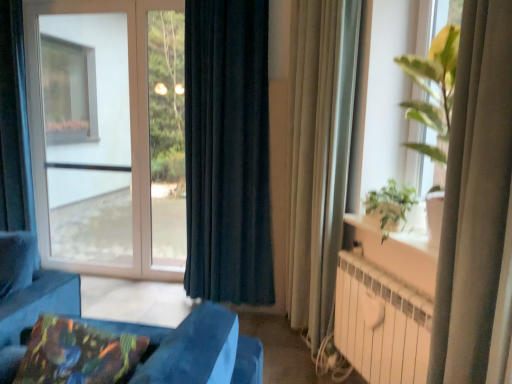
Question: Relative to green leafy plant at upper right, marked as the first window in a right-to-left arrangement, is white metallic radiator at lower right in front or behind?

Choices:
 (A) behind
 (B) front

Answer: (A)

Question: Would you say white metallic radiator at lower right is inside or outside green leafy plant at upper right, marked as the first window in a right-to-left arrangement?

Choices:
 (A) inside
 (B) outside

Answer: (B)

Question: Estimate the real-world distances between objects in this image. Which object is farther from the transparent glass window at left, the second window when ordered from front to back?

Choices:
 (A) green leafy plant at right
 (B) beige fabric curtain at right, the second curtain when ordered from left to right
 (C) green leafy plant at upper right, marked as the first window in a right-to-left arrangement
 (D) beige sheer curtain at right, arranged as the first curtain when viewed from the right
 (E) dark blue fabric curtain at center, the 1th curtain from the left

Answer: (D)

Question: Estimate the real-world distances between objects in this image. Which object is farther from the beige fabric curtain at right, which appears as the 2th curtain when viewed from the front?

Choices:
 (A) transparent glass window at left, the first window in the left-to-right sequence
 (B) multicolored fabric pillow at lower left
 (C) green leafy plant at right
 (D) dark blue fabric curtain at center, the 3th curtain from the right
 (E) white metallic radiator at lower right

Answer: (A)